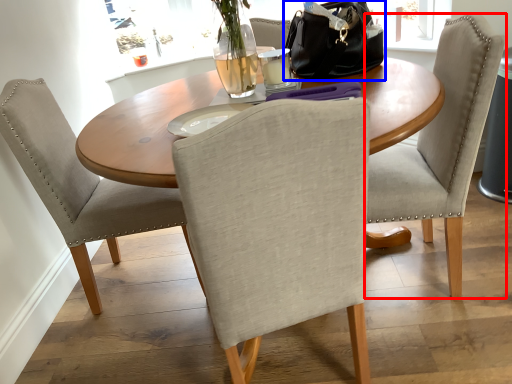
Question: Which object is closer to the camera taking this photo, chair (highlighted by a red box) or handbag (highlighted by a blue box)?

Choices:
 (A) chair
 (B) handbag

Answer: (A)